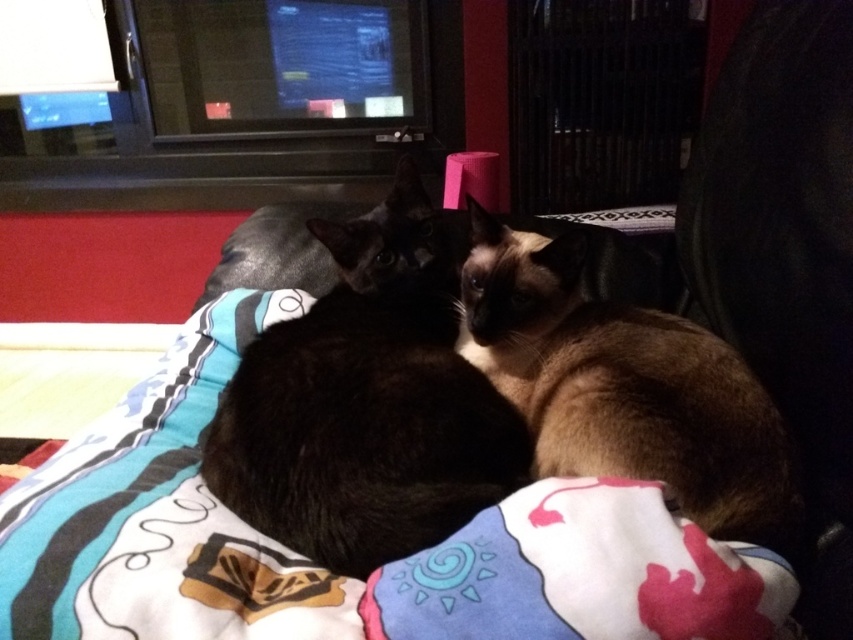
Is point (99, 624) closer to camera compared to point (740, 368)?

Yes, it is in front of point (740, 368).

Between point (518, 492) and point (683, 332), which one is positioned behind?

The point (683, 332) is behind.

Identify the location of printed cotton blanket at center. The height and width of the screenshot is (640, 853). (325, 570).

Does silky black cat at center have a lesser width compared to brown silky cat at center?

In fact, silky black cat at center might be wider than brown silky cat at center.

Image resolution: width=853 pixels, height=640 pixels. I want to click on silky black cat at center, so click(364, 404).

What are the coordinates of `silky black cat at center` in the screenshot? It's located at (364, 404).

Does printed cotton blanket at center appear under silky black cat at center?

Yes.

Measure the distance between printed cotton blanket at center and camera.

A distance of 19.20 inches exists between printed cotton blanket at center and camera.

Where is `printed cotton blanket at center`? This screenshot has height=640, width=853. printed cotton blanket at center is located at coordinates (325, 570).